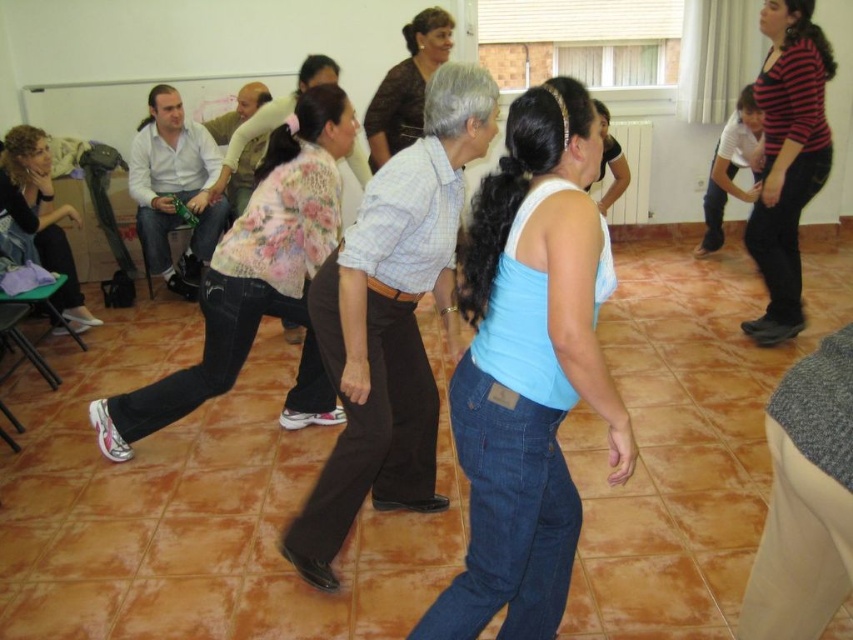
Is brown cotton pants at center smaller than matte white shirt at left?

No.

Locate an element on the screen. brown cotton pants at center is located at coordinates (392, 323).

Is brown cotton pants at center above floral-patterned shirt at center?

Actually, brown cotton pants at center is below floral-patterned shirt at center.

Can you confirm if brown cotton pants at center is smaller than floral-patterned shirt at center?

Indeed, brown cotton pants at center has a smaller size compared to floral-patterned shirt at center.

Identify the location of brown cotton pants at center. (392, 323).

Can you confirm if light blue denim jeans at center is wider than floral-patterned shirt at center?

In fact, light blue denim jeans at center might be narrower than floral-patterned shirt at center.

Which is above, light blue denim jeans at center or floral-patterned shirt at center?

floral-patterned shirt at center is above.

This screenshot has width=853, height=640. In order to click on light blue denim jeans at center in this screenshot , I will do `click(527, 369)`.

At what (x,y) coordinates should I click in order to perform the action: click on light blue denim jeans at center. Please return your answer as a coordinate pair (x, y). The image size is (853, 640). Looking at the image, I should click on (527, 369).